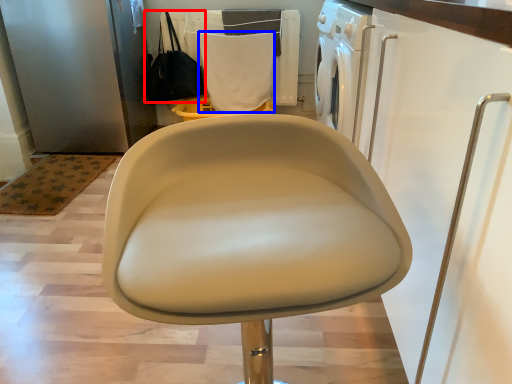
Question: Which object is closer to the camera taking this photo, handbag (highlighted by a red box) or cloth (highlighted by a blue box)?

Choices:
 (A) handbag
 (B) cloth

Answer: (A)